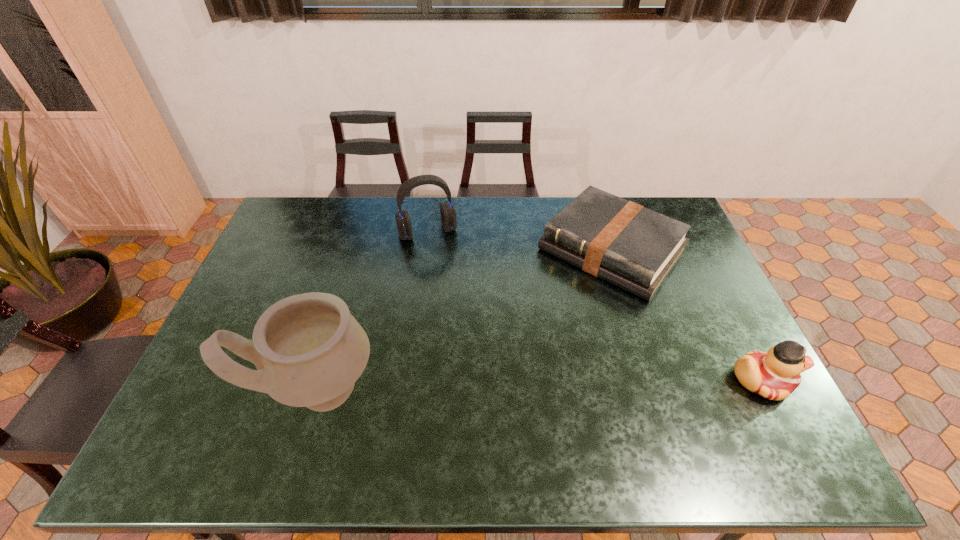
The height and width of the screenshot is (540, 960). Identify the location of vacant space located 0.090m on the spine side of the hardback book. (560, 308).

Where is `headset that is at the far edge`? The image size is (960, 540). headset that is at the far edge is located at coordinates (447, 211).

This screenshot has width=960, height=540. Find the location of `hardback book located in the far edge section of the desktop`. hardback book located in the far edge section of the desktop is located at coordinates (630, 246).

You are a GUI agent. You are given a task and a screenshot of the screen. Output one action in this format:
    pyautogui.click(x=<x>, y=<y>)
    Task: Click on the pottery present at the near edge
    Image resolution: width=960 pixels, height=540 pixels.
    Given the screenshot: What is the action you would take?
    pyautogui.click(x=309, y=351)

You are a GUI agent. You are given a task and a screenshot of the screen. Output one action in this format:
    pyautogui.click(x=<x>, y=<y>)
    Task: Click on the duck positioned at the near edge
    
    Given the screenshot: What is the action you would take?
    pyautogui.click(x=774, y=375)

At what (x,y) coordinates should I click in order to perform the action: click on duck that is at the right edge. Please return your answer as a coordinate pair (x, y). This screenshot has height=540, width=960. Looking at the image, I should click on (774, 375).

Where is `hardback book present at the right edge`? Image resolution: width=960 pixels, height=540 pixels. hardback book present at the right edge is located at coordinates (630, 246).

At what (x,y) coordinates should I click in order to perform the action: click on object that is at the far right corner. Please return your answer as a coordinate pair (x, y). The width and height of the screenshot is (960, 540). Looking at the image, I should click on (630, 246).

Image resolution: width=960 pixels, height=540 pixels. What are the coordinates of `object at the near right corner` in the screenshot? It's located at (774, 375).

You are a GUI agent. You are given a task and a screenshot of the screen. Output one action in this format:
    pyautogui.click(x=<x>, y=<y>)
    Task: Click on the free space at the far edge of the desktop
    
    Given the screenshot: What is the action you would take?
    pyautogui.click(x=388, y=213)